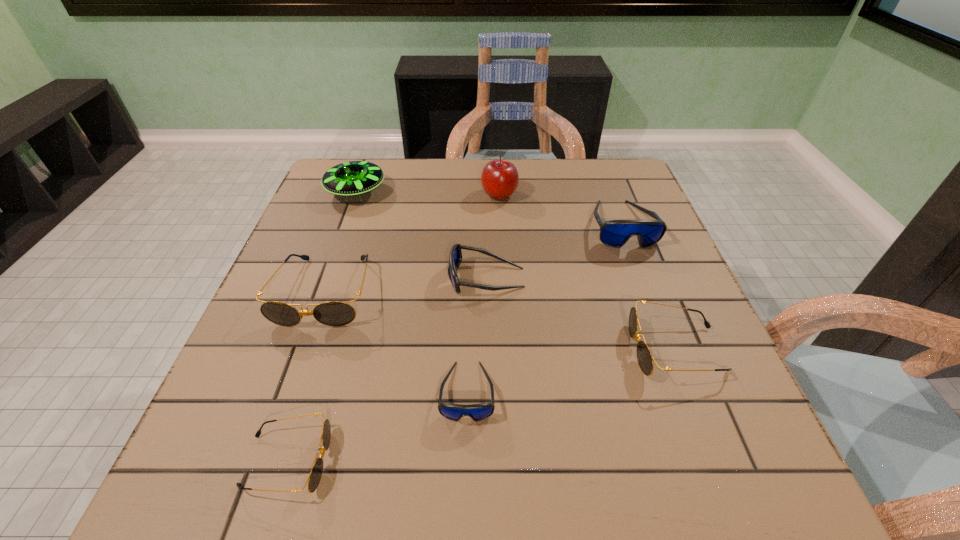
At what (x,y) coordinates should I click in order to perform the action: click on the smallest black sunglasses. Please return your answer as a coordinate pair (x, y). Image resolution: width=960 pixels, height=540 pixels. Looking at the image, I should click on (314, 478).

Locate an element on the screen. The width and height of the screenshot is (960, 540). free space located on the right of the tallest object is located at coordinates (540, 194).

Identify the location of free region located on the right of the saucer. (446, 191).

Identify the location of vacant space situated 0.320m on the front-facing side of the farthest blue sunglasses. (674, 364).

Where is `blank space located 0.330m on the lenses of the biggest black sunglasses`? The image size is (960, 540). blank space located 0.330m on the lenses of the biggest black sunglasses is located at coordinates (250, 505).

Where is `free space located 0.120m on the front-facing side of the second farthest blue sunglasses`? free space located 0.120m on the front-facing side of the second farthest blue sunglasses is located at coordinates (396, 278).

The width and height of the screenshot is (960, 540). I want to click on free region located on the front-facing side of the second farthest blue sunglasses, so click(310, 278).

This screenshot has width=960, height=540. In order to click on free spot located 0.370m on the front-facing side of the second farthest blue sunglasses in this screenshot , I will do `click(283, 278)`.

The height and width of the screenshot is (540, 960). I want to click on vacant area situated 0.210m on the lenses of the rightmost black sunglasses, so click(522, 349).

Identify the location of vacant space located on the lenses of the rightmost black sunglasses. (606, 349).